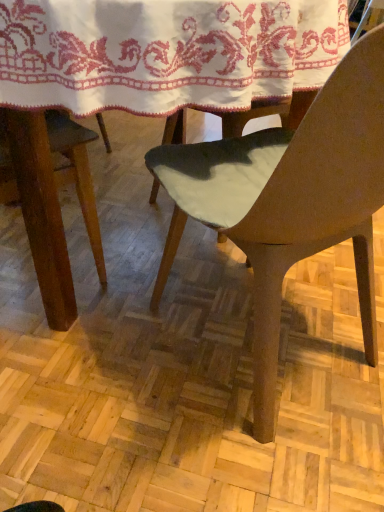
Question: Is white embroidered cloth at upper center wider or thinner than matte brown chair at center?

Choices:
 (A) wide
 (B) thin

Answer: (A)

Question: From the image's perspective, relative to matte brown chair at center, is white embroidered cloth at upper center above or below?

Choices:
 (A) below
 (B) above

Answer: (B)

Question: From a real-world perspective, is white embroidered cloth at upper center physically located above or below matte brown chair at center?

Choices:
 (A) below
 (B) above

Answer: (B)

Question: Which is correct: matte brown chair at center is inside white embroidered cloth at upper center, or outside of it?

Choices:
 (A) outside
 (B) inside

Answer: (A)

Question: From the image's perspective, is matte brown chair at center above or below white embroidered cloth at upper center?

Choices:
 (A) above
 (B) below

Answer: (B)

Question: Looking at their shapes, would you say matte brown chair at center is wider or thinner than white embroidered cloth at upper center?

Choices:
 (A) wide
 (B) thin

Answer: (B)

Question: Is matte brown chair at center taller or shorter than white embroidered cloth at upper center?

Choices:
 (A) short
 (B) tall

Answer: (B)